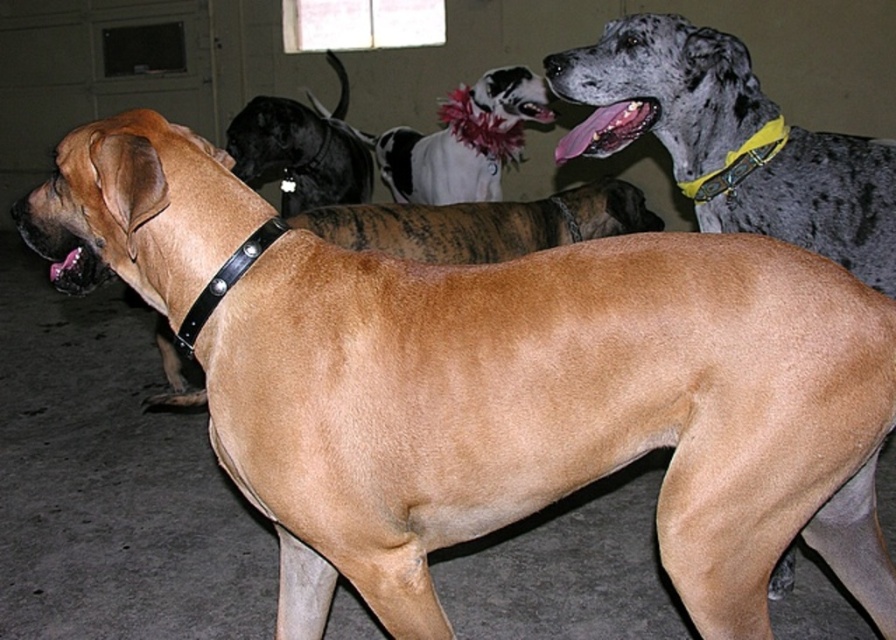
Question: Observing the image, what is the correct spatial positioning of yellow fabric collar at upper right in reference to pink leather collar at lower left?

Choices:
 (A) left
 (B) right

Answer: (B)

Question: Does speckled fur dog at upper right appear over pink leather collar at lower left?

Choices:
 (A) yes
 (B) no

Answer: (A)

Question: Where is black leather collar at upper left located in relation to pink leather collar at lower left in the image?

Choices:
 (A) below
 (B) above

Answer: (B)

Question: Which object is positioned closest to the black leather collar at upper left?

Choices:
 (A) speckled fur dog at upper right
 (B) white-spotted fur at center

Answer: (B)

Question: Estimate the real-world distances between objects in this image. Which object is closer to the white-spotted fur at center?

Choices:
 (A) speckled fur mouth at upper right
 (B) black leather collar at upper left
 (C) yellow fabric collar at upper right
 (D) pink leather collar at lower left

Answer: (B)

Question: Estimate the real-world distances between objects in this image. Which object is farther from the white-spotted fur at center?

Choices:
 (A) pink leather collar at lower left
 (B) yellow fabric collar at upper right
 (C) speckled fur dog at upper right
 (D) speckled fur mouth at upper right

Answer: (A)